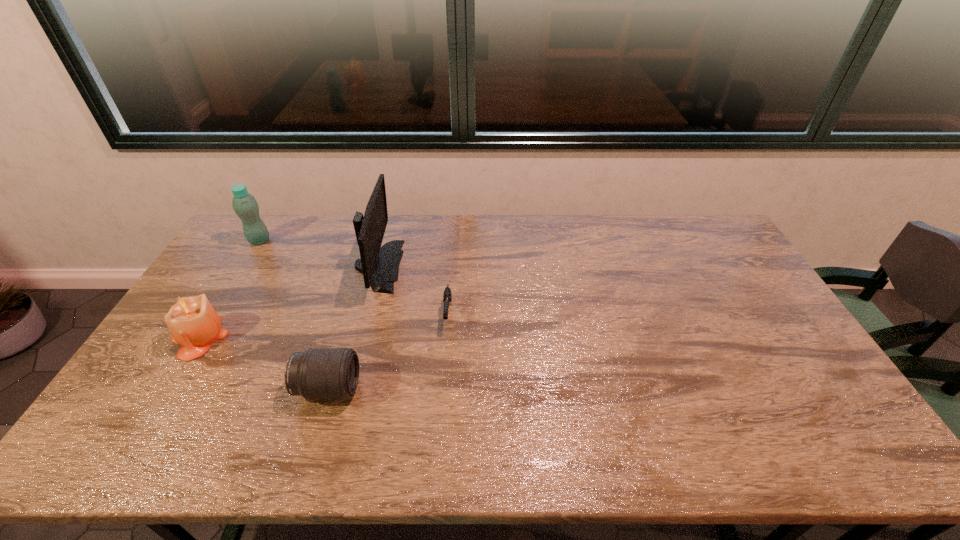
Find the location of `object that is the second closest to the third tallest object`. object that is the second closest to the third tallest object is located at coordinates (379, 265).

In order to click on free spot that satisfies the following two spatial constraints: 1. at the end of the barrel of the gun; 2. on the surface of the nearest object in this screenshot , I will do coord(443,388).